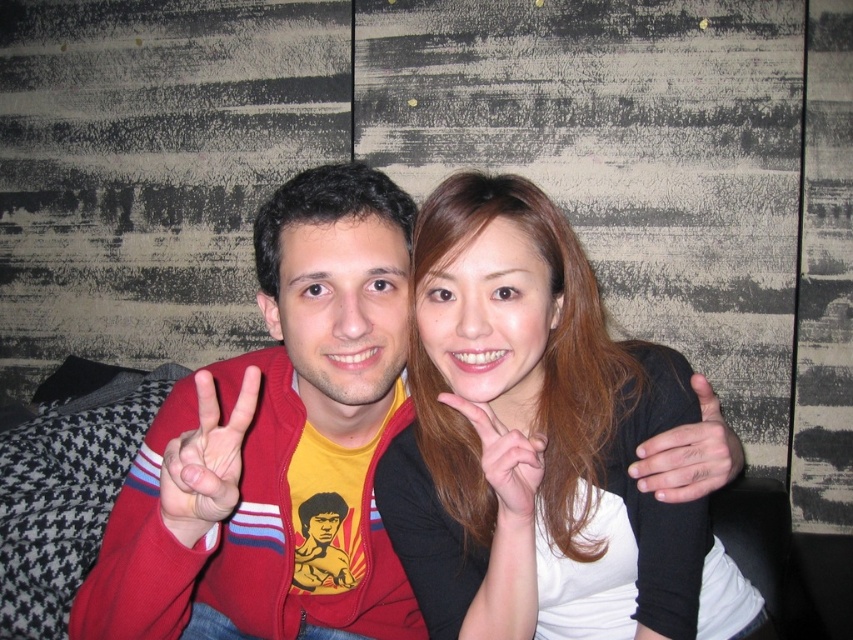
You are a photographer trying to capture the scene where the two people are standing. You want to ensure that the matte red sweater at left and the matte black hand at center are both in focus. Which object should you focus on first to ensure both are sharp? Explain your reasoning based on their positions.

Since the matte red sweater at left is to the left of the matte black hand at center, you should focus on the matte red sweater at left first. By focusing on the closer object, the depth of field will extend backward, potentially keeping both objects in focus.

Looking at this image, you are a photographer standing 30 inches away from the wall. You want to focus your camera on the matte red sweater at left without blurring the background wall. Is the current distance sufficient to ensure the sweater is in focus?

The matte red sweater at left is 25.12 inches from the camera. Since you are standing 30 inches away from the wall, the sweater is closer than your current position. To focus on the sweater, you need to move closer to it so that the distance between the camera and the sweater is within the camera focus range. However, since the sweater is already 25.12 inches away from the camera and you are 30 inches from the wall, the sweater is within your focusing range if your camera can focus at that distance. But to

You are trying to identify the position of the smooth skin hand at center in the image. According to the coordinates provided, what are the exact coordinates of this hand?

The smooth skin hand at center is located at point (689, 452).